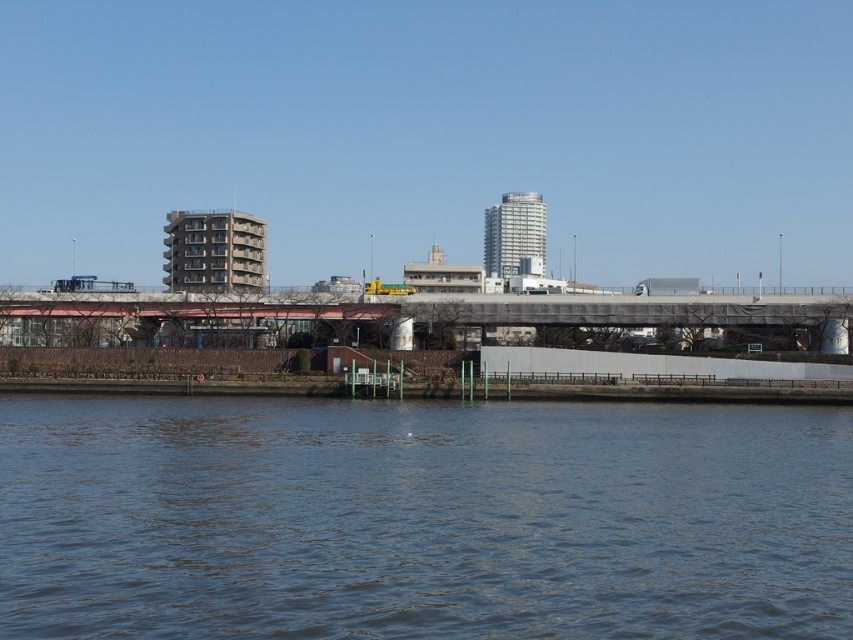
Question: Is blue water at lower center closer to the viewer compared to metallic gray bridge at center?

Choices:
 (A) yes
 (B) no

Answer: (A)

Question: Considering the relative positions of blue water at lower center and metallic gray bridge at center in the image provided, where is blue water at lower center located with respect to metallic gray bridge at center?

Choices:
 (A) left
 (B) right

Answer: (B)

Question: Is blue water at lower center above metallic gray bridge at center?

Choices:
 (A) no
 (B) yes

Answer: (A)